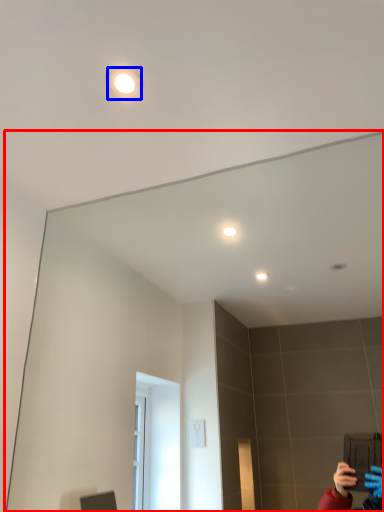
Question: Among these objects, which one is nearest to the camera, mirror (highlighted by a red box) or light (highlighted by a blue box)?

Choices:
 (A) mirror
 (B) light

Answer: (A)